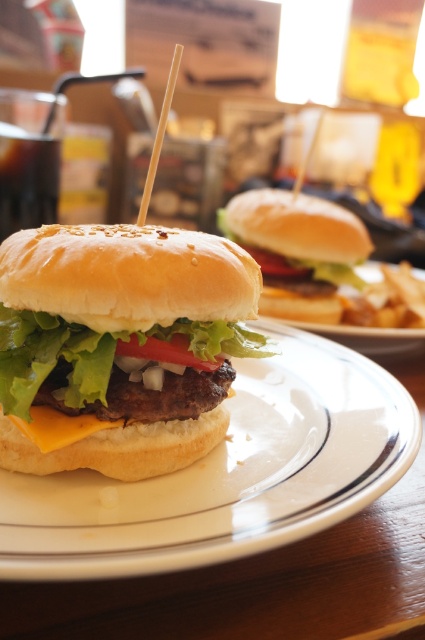
You are a food critic evaluating this burger. You notice the slightly toasted bun at center and the yellowish cheese at center. Which ingredient is closer to you?

The slightly toasted bun at center is closer to you because the yellowish cheese at center is behind it.

You are a food critic who wants to describe the layers of the cheeseburger from top to bottom. Based on the image, which object is positioned above the other between the slightly toasted bun at center and the yellowish cheese at center?

The slightly toasted bun at center is located above the yellowish cheese at center, so the bun is the topmost layer followed by the cheese.

From the picture: You are a food photographer and need to ensure that the white ceramic plate at center and the slightly toasted bun at center are framed properly. Based on their sizes, which object should you focus on to ensure the plate is centered in the frame?

The white ceramic plate at center is wider than the slightly toasted bun at center. Therefore, focusing on the plate will ensure the frame is centered around the larger object.